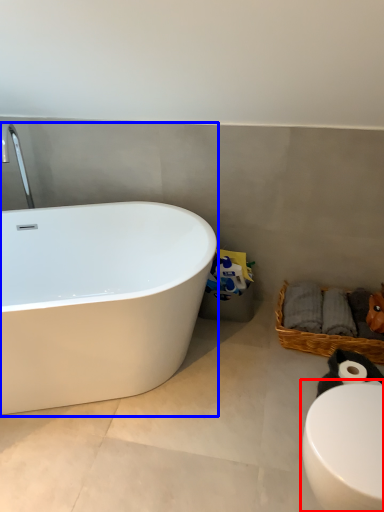
Question: Which of the following is the closest to the observer, toilet (highlighted by a red box) or bathtub (highlighted by a blue box)?

Choices:
 (A) toilet
 (B) bathtub

Answer: (A)